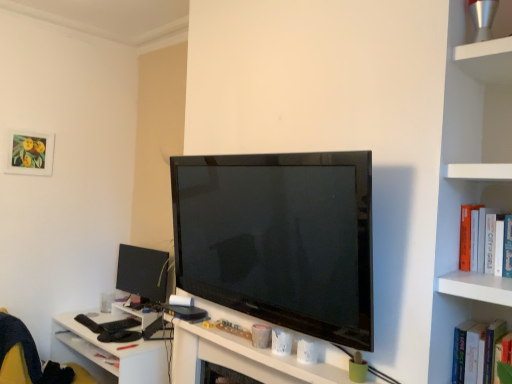
Question: Can you confirm if white matte computer desk at center is smaller than white hardcover book at right?

Choices:
 (A) yes
 (B) no

Answer: (B)

Question: Considering the relative positions of white matte computer desk at center and white hardcover book at right in the image provided, is white matte computer desk at center behind white hardcover book at right?

Choices:
 (A) yes
 (B) no

Answer: (A)

Question: Considering the relative positions of white matte computer desk at center and white hardcover book at right in the image provided, is white matte computer desk at center to the left of white hardcover book at right from the viewer's perspective?

Choices:
 (A) no
 (B) yes

Answer: (B)

Question: Is white matte computer desk at center taller than white hardcover book at right?

Choices:
 (A) no
 (B) yes

Answer: (A)

Question: Can you confirm if white matte computer desk at center is bigger than white hardcover book at right?

Choices:
 (A) yes
 (B) no

Answer: (A)

Question: Considering the relative sizes of white matte computer desk at center and white hardcover book at right in the image provided, is white matte computer desk at center thinner than white hardcover book at right?

Choices:
 (A) yes
 (B) no

Answer: (B)

Question: Is the depth of yellow fabric swivel chair at lower left greater than that of white hardcover book at right?

Choices:
 (A) no
 (B) yes

Answer: (B)

Question: Is the depth of yellow fabric swivel chair at lower left less than that of white hardcover book at right?

Choices:
 (A) yes
 (B) no

Answer: (B)

Question: Can you confirm if yellow fabric swivel chair at lower left is taller than white hardcover book at right?

Choices:
 (A) no
 (B) yes

Answer: (B)

Question: From the image's perspective, is yellow fabric swivel chair at lower left on top of white hardcover book at right?

Choices:
 (A) yes
 (B) no

Answer: (B)

Question: Is yellow fabric swivel chair at lower left to the right of white hardcover book at right from the viewer's perspective?

Choices:
 (A) yes
 (B) no

Answer: (B)

Question: Can we say yellow fabric swivel chair at lower left lies outside white hardcover book at right?

Choices:
 (A) no
 (B) yes

Answer: (B)

Question: Is matte paper picture frame at upper left bigger than white glossy table at lower left?

Choices:
 (A) yes
 (B) no

Answer: (B)